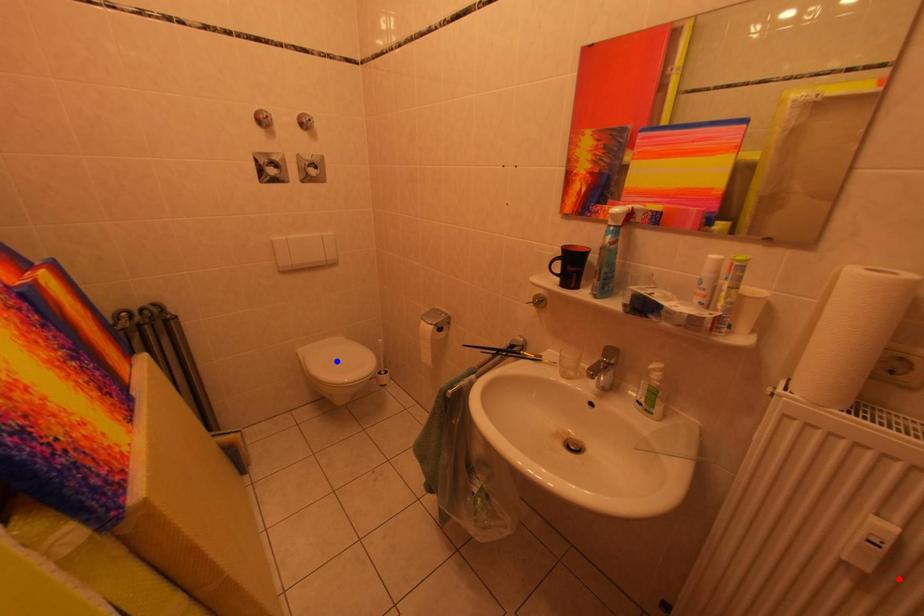
Question: In the image, two points are highlighted. Which point is nearer to the camera? Reply with the corresponding letter.

Choices:
 (A) blue point
 (B) red point

Answer: (B)